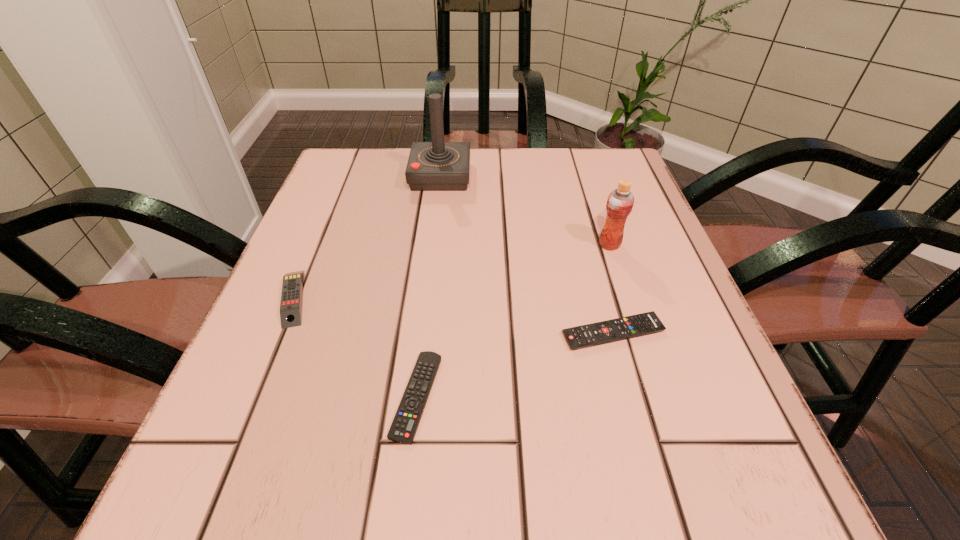
The height and width of the screenshot is (540, 960). What are the coordinates of `free point between the orange juice and the nearest remote control` in the screenshot? It's located at (513, 320).

You are a GUI agent. You are given a task and a screenshot of the screen. Output one action in this format:
    pyautogui.click(x=<x>, y=<y>)
    Task: Click on the free space between the third shortest object and the second shortest object
    
    Given the screenshot: What is the action you would take?
    pyautogui.click(x=453, y=315)

Find the location of a particular element. The width and height of the screenshot is (960, 540). vacant point located between the tallest object and the fourth tallest object is located at coordinates (527, 255).

Where is `free spot between the second shortest object and the orange juice`? free spot between the second shortest object and the orange juice is located at coordinates click(x=612, y=289).

This screenshot has width=960, height=540. In order to click on empty space between the shortest object and the farthest object in this screenshot , I will do `click(428, 286)`.

Point out which object is positioned as the nearest to the rightmost remote control. Please provide its 2D coordinates. Your answer should be formatted as a tuple, i.e. [(x, y)], where the tuple contains the x and y coordinates of a point satisfying the conditions above.

[(620, 201)]

This screenshot has height=540, width=960. In order to click on the closest object to the fourth shortest object in this screenshot , I will do `click(633, 326)`.

Locate which remote control ranks second in proximity to the shortest object. Please provide its 2D coordinates. Your answer should be formatted as a tuple, i.e. [(x, y)], where the tuple contains the x and y coordinates of a point satisfying the conditions above.

[(633, 326)]

Identify which remote control is the third closest to the joystick. Please provide its 2D coordinates. Your answer should be formatted as a tuple, i.e. [(x, y)], where the tuple contains the x and y coordinates of a point satisfying the conditions above.

[(403, 429)]

The image size is (960, 540). I want to click on vacant space that satisfies the following two spatial constraints: 1. on the rectangular base of the tallest object; 2. on the right side of the second tallest object, so click(432, 245).